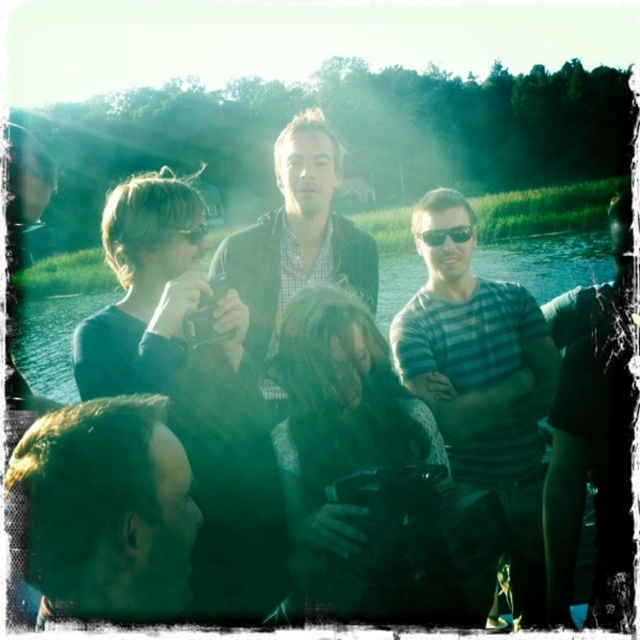
You are a photographer trying to capture the scene. You notice the dark hair at center and the greenish water at center. Which of these two elements has a smaller width in the image?

The dark hair at center is thinner than the greenish water at center, so the dark hair at center has a smaller width in the image.

You are a photographer trying to capture a closeup of the dark hair at center without including the matte black jacket at center in the frame. Is this possible given their positions?

The dark hair at center is below the matte black jacket at center, so it is possible to frame the shot to exclude the jacket by positioning the camera below the jacket and focusing on the hair.

You are standing in the scene and want to take a photo of the greenish water at center without anyone blocking it. Is the dark hair at center in the way?

Yes, the dark hair at center is in front of the greenish water at center, so it would block the view of the water.